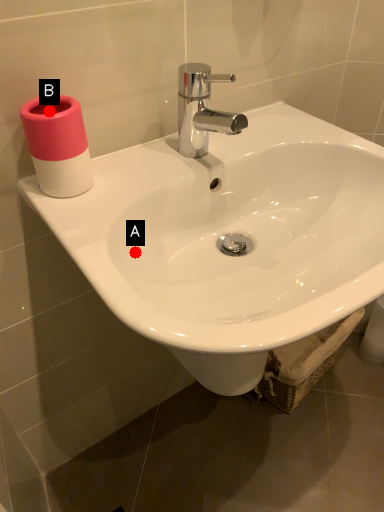
Question: Two points are circled on the image, labeled by A and B beside each circle. Which point appears closest to the camera in this image?

Choices:
 (A) A is closer
 (B) B is closer

Answer: (B)